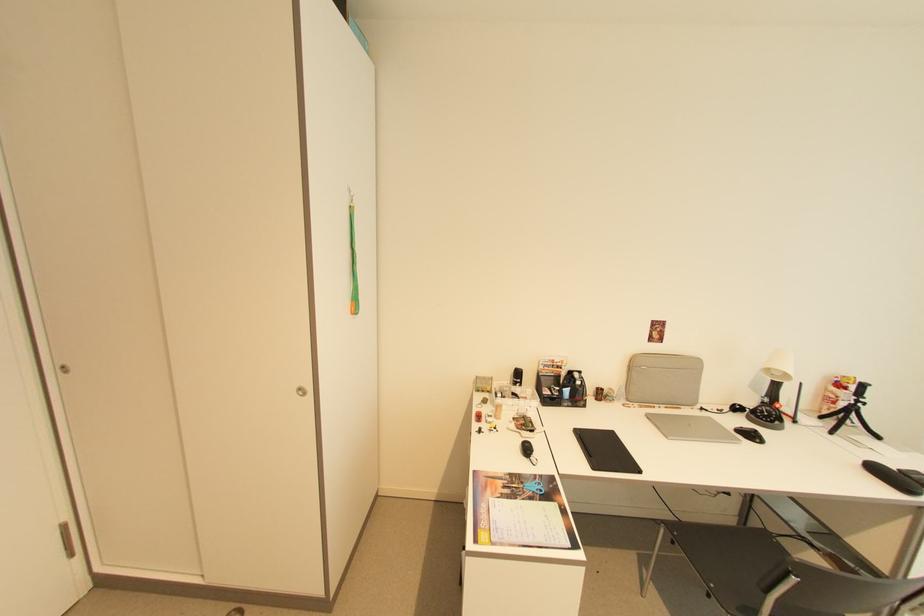
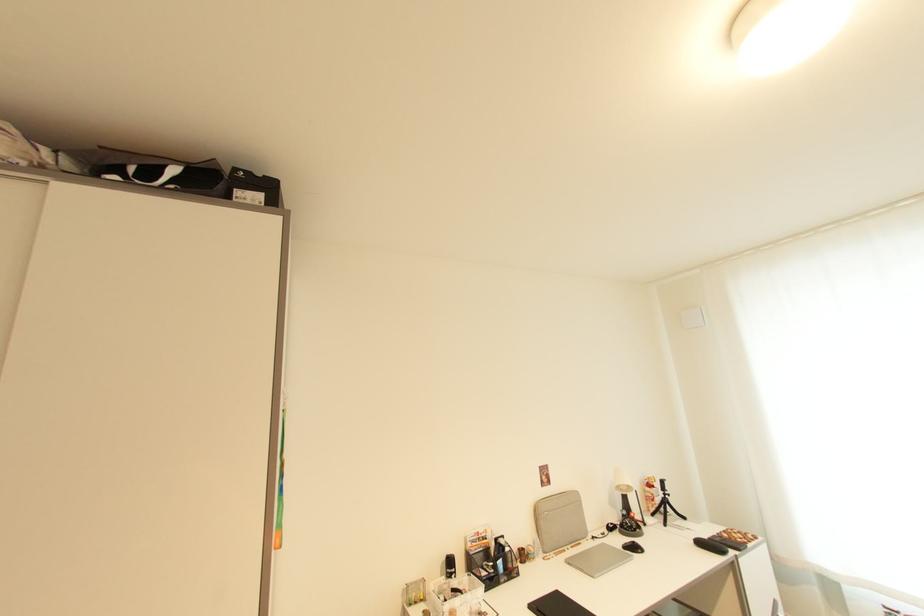
In the second image, find the point that corresponds to [617,434] in the first image.

(562, 594)